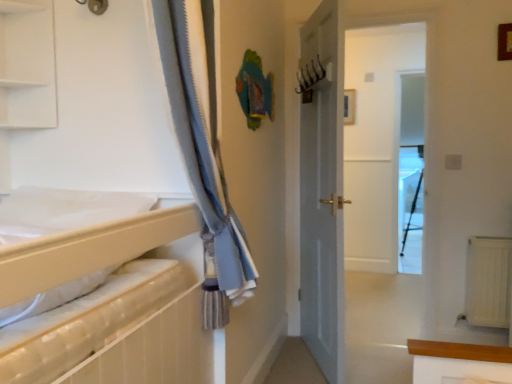
The width and height of the screenshot is (512, 384). Describe the element at coordinates (27, 64) in the screenshot. I see `white matte shelf at upper left` at that location.

Measure the distance between point (45, 114) and camera.

They are 1.92 meters apart.

Image resolution: width=512 pixels, height=384 pixels. Find the location of `wooden picture frame at upper right`. wooden picture frame at upper right is located at coordinates pos(505,42).

What do you see at coordinates (411, 172) in the screenshot?
I see `transparent glass screen door at center` at bounding box center [411, 172].

Image resolution: width=512 pixels, height=384 pixels. What do you see at coordinates (488, 281) in the screenshot?
I see `white textured radiator at lower right` at bounding box center [488, 281].

The height and width of the screenshot is (384, 512). Find the location of `white matte sheet at left`. white matte sheet at left is located at coordinates (63, 211).

Is white matte shelf at upper left completely or partially outside of wooden picture frame at upper right?

Yes, white matte shelf at upper left is outside of wooden picture frame at upper right.

Does point (47, 87) appear closer or farther from the camera than point (498, 38)?

Point (47, 87) is closer to the camera than point (498, 38).

Locate an element on the screen. The image size is (512, 384). shelf below the wooden picture frame at upper right (from the image's perspective) is located at coordinates (x=27, y=64).

Looking at their sizes, would you say wooden picture frame at upper right is wider or thinner than transparent glass screen door at center?

In the image, wooden picture frame at upper right appears to be more narrow than transparent glass screen door at center.

Based on the photo, is wooden picture frame at upper right situated inside transparent glass screen door at center or outside?

The correct answer is: outside.

From the picture: Considering the sizes of objects wooden picture frame at upper right and transparent glass screen door at center in the image provided, who is taller, wooden picture frame at upper right or transparent glass screen door at center?

With more height is transparent glass screen door at center.

From the image's perspective, which one is positioned higher, white matte shelf at upper left or transparent glass screen door at center?

white matte shelf at upper left, from the image's perspective.

Are white matte shelf at upper left and transparent glass screen door at center located far from each other?

Answer: Yes.

Is white matte shelf at upper left smaller than transparent glass screen door at center?

No.

From a real-world perspective, relative to transparent glass screen door at center, is white matte shelf at upper left vertically above or below?

white matte shelf at upper left is situated higher than transparent glass screen door at center in the real world.

From the image's perspective, is white textured radiator at lower right on transparent glass screen door at center?

No.

Where is `radiator below the transparent glass screen door at center (from the image's perspective)`? radiator below the transparent glass screen door at center (from the image's perspective) is located at coordinates (488, 281).

Can you tell me how much white textured radiator at lower right and transparent glass screen door at center differ in facing direction?

3.56 degrees.

Is white textured radiator at lower right outside of transparent glass screen door at center?

white textured radiator at lower right lies outside transparent glass screen door at center's area.

Is white matte sheet at left aimed at white matte shelf at upper left?

No, white matte sheet at left is not aimed at white matte shelf at upper left.

Which object is further away from the camera, white matte sheet at left or white matte shelf at upper left?

Positioned behind is white matte shelf at upper left.

From the image's perspective, would you say white matte sheet at left is shown under white matte shelf at upper left?

Yes.

Choose the correct answer: Is white matte sheet at left inside white matte shelf at upper left or outside it?

white matte sheet at left cannot be found inside white matte shelf at upper left.

Which of these two, transparent glass screen door at center or white textured radiator at lower right, is thinner?

transparent glass screen door at center is thinner.

Can you confirm if transparent glass screen door at center is positioned to the right of white textured radiator at lower right?

Yes.

How different are the orientations of transparent glass screen door at center and white textured radiator at lower right in degrees?

There is a 3.56-degree angle between the facing directions of transparent glass screen door at center and white textured radiator at lower right.

Is transparent glass screen door at center completely or partially outside of white textured radiator at lower right?

Yes, transparent glass screen door at center is located beyond the bounds of white textured radiator at lower right.

Could you tell me if wooden picture frame at upper right is turned towards white matte sheet at left?

No, wooden picture frame at upper right is not turned towards white matte sheet at left.

From the image's perspective, is wooden picture frame at upper right on top of white matte sheet at left?

Yes, from the image's perspective, wooden picture frame at upper right is over white matte sheet at left.

Does point (509, 44) come in front of point (116, 207)?

No.

I want to click on shelf located in front of the wooden picture frame at upper right, so click(x=27, y=64).

At what (x,y) coordinates should I click in order to perform the action: click on screen door behind the wooden picture frame at upper right. Please return your answer as a coordinate pair (x, y). This screenshot has height=384, width=512. Looking at the image, I should click on (411, 172).

Which object lies further to the anchor point wooden picture frame at upper right, white matte sheet at left or white textured radiator at lower right?

The object further to wooden picture frame at upper right is white matte sheet at left.

Considering their positions, is white textured radiator at lower right positioned further to transparent glass screen door at center than white matte shelf at upper left?

white matte shelf at upper left is further to transparent glass screen door at center.

Looking at the image, which one is located closer to white matte sheet at left, white matte shelf at upper left or white textured radiator at lower right?

Based on the image, white matte shelf at upper left appears to be nearer to white matte sheet at left.

Estimate the real-world distances between objects in this image. Which object is closer to transparent glass screen door at center, white matte sheet at left or white matte shelf at upper left?

The object closer to transparent glass screen door at center is white matte shelf at upper left.

Estimate the real-world distances between objects in this image. Which object is closer to wooden picture frame at upper right, white textured radiator at lower right or white matte shelf at upper left?

white textured radiator at lower right lies closer to wooden picture frame at upper right than the other object.

Estimate the real-world distances between objects in this image. Which object is further from wooden picture frame at upper right, white textured radiator at lower right or white matte sheet at left?

white matte sheet at left is positioned further to the anchor wooden picture frame at upper right.

Considering their positions, is transparent glass screen door at center positioned closer to white textured radiator at lower right than white matte shelf at upper left?

transparent glass screen door at center.

When comparing their distances from white textured radiator at lower right, does white matte shelf at upper left or transparent glass screen door at center seem further?

The object further to white textured radiator at lower right is white matte shelf at upper left.

The width and height of the screenshot is (512, 384). Find the location of `radiator between wooden picture frame at upper right and transparent glass screen door at center along the z-axis`. radiator between wooden picture frame at upper right and transparent glass screen door at center along the z-axis is located at coordinates (488, 281).

The height and width of the screenshot is (384, 512). In order to click on picture frame between white matte sheet at left and transparent glass screen door at center from front to back in this screenshot , I will do `click(505, 42)`.

This screenshot has width=512, height=384. I want to click on sheet between white matte shelf at upper left and wooden picture frame at upper right from left to right, so click(x=63, y=211).

The height and width of the screenshot is (384, 512). I want to click on radiator between white matte shelf at upper left and transparent glass screen door at center from left to right, so click(488, 281).